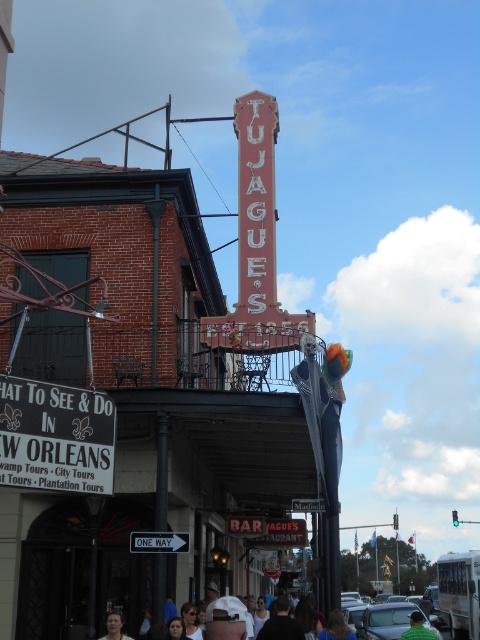
You are a photographer standing at the street corner where the Tujague sign is located. You want to take a photo of the green fabric shirt at lower center and the smooth skin face at lower center. How far apart are these two objects in the photo?

The green fabric shirt at lower center is 28.21 meters from the smooth skin face at lower center.

You are a tourist standing at the entrance of the street and want to read both the red painted metal sign at upper center and the white plastic sign at center. Given that you have a neck injury and can only tilt your head up to 30 degrees, can you read both signs without moving your head?

The red painted metal sign at upper center and white plastic sign at center are 18.26 meters apart. Since the distance between them is too great, you cannot read both signs without moving your head due to the limited neck tilt of 30 degrees.